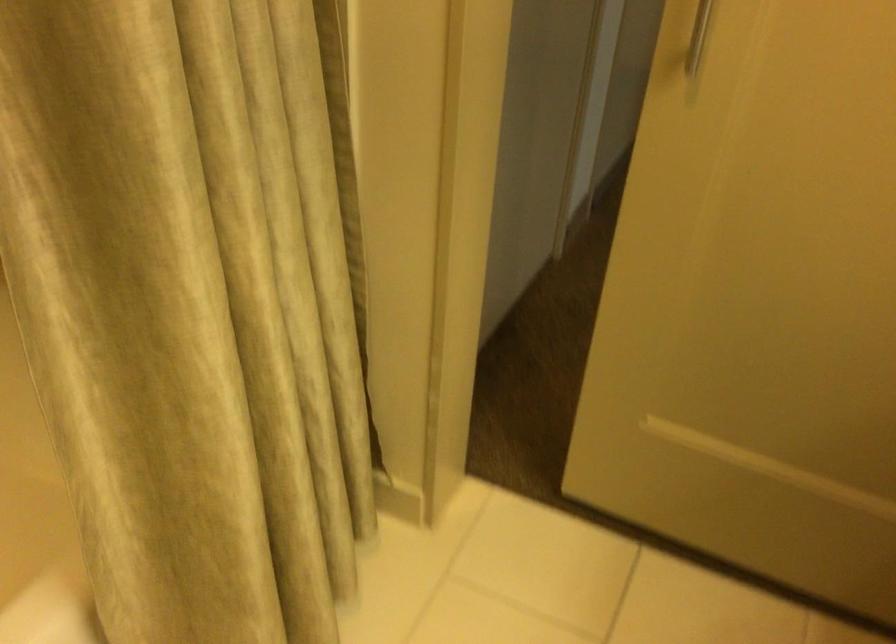
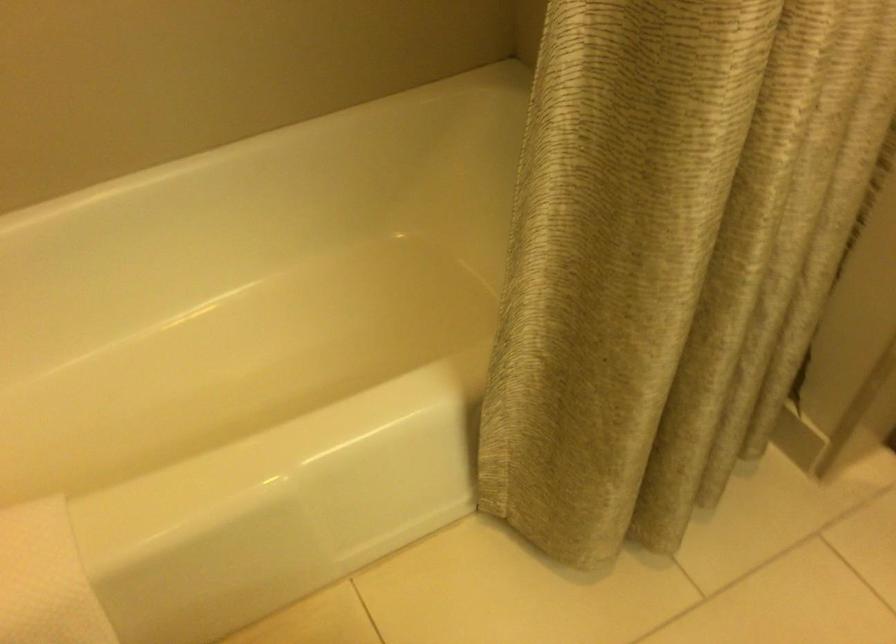
Question: How did the camera likely rotate?

Choices:
 (A) Left
 (B) Right
 (C) Up
 (D) Down

Answer: (A)